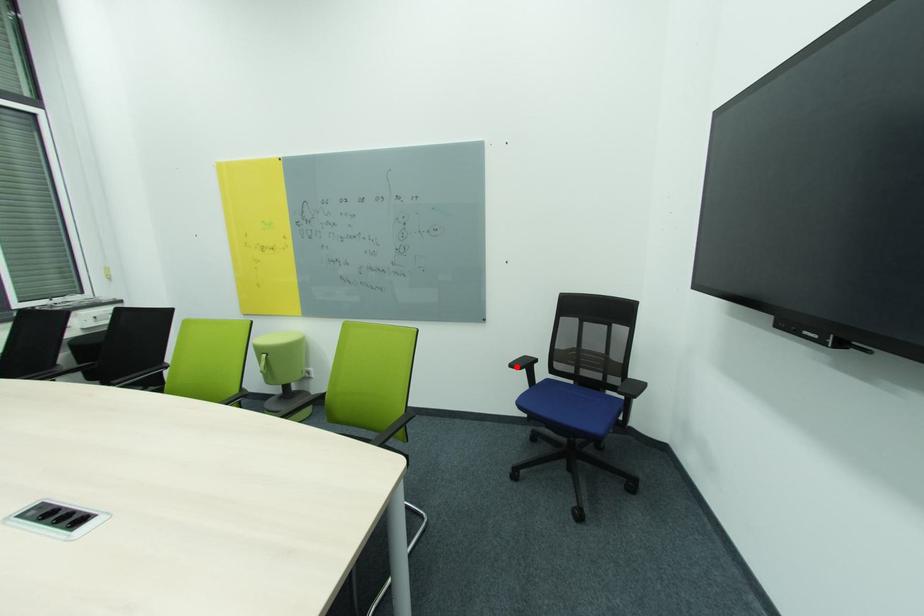
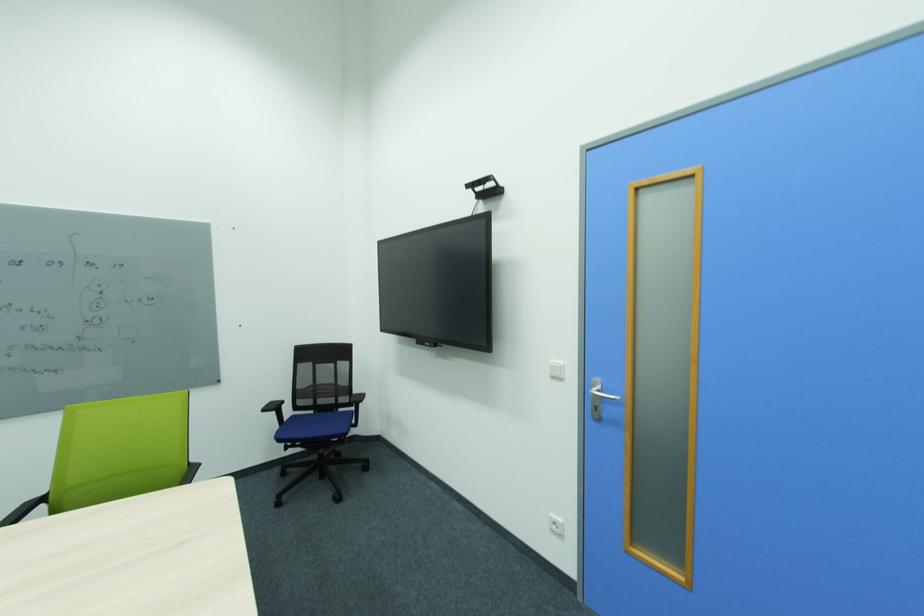
The point at the highlighted location is marked in the first image. Where is the corresponding point in the second image?

(270, 411)